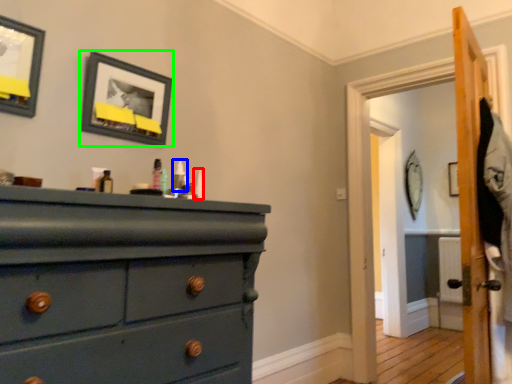
Question: Which object is positioned closest to toiletry (highlighted by a red box)? Select from toiletry (highlighted by a blue box) and picture frame (highlighted by a green box).

Choices:
 (A) toiletry
 (B) picture frame

Answer: (A)